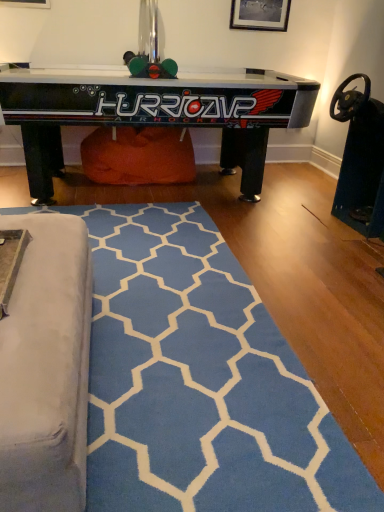
Question: Is black glossy air hockey table at upper center positioned with its back to wooden picture frame at upper center?

Choices:
 (A) yes
 (B) no

Answer: (A)

Question: Is black glossy air hockey table at upper center shorter than wooden picture frame at upper center?

Choices:
 (A) no
 (B) yes

Answer: (A)

Question: Does black glossy air hockey table at upper center have a lesser width compared to wooden picture frame at upper center?

Choices:
 (A) no
 (B) yes

Answer: (A)

Question: Can you confirm if black glossy air hockey table at upper center is smaller than wooden picture frame at upper center?

Choices:
 (A) no
 (B) yes

Answer: (A)

Question: Is black glossy air hockey table at upper center at the left side of wooden picture frame at upper center?

Choices:
 (A) yes
 (B) no

Answer: (A)

Question: In terms of size, does black glossy air hockey table at upper center appear bigger or smaller than blue soft rug at lower center?

Choices:
 (A) big
 (B) small

Answer: (A)

Question: Is black glossy air hockey table at upper center in front of or behind blue soft rug at lower center in the image?

Choices:
 (A) behind
 (B) front

Answer: (A)

Question: From their relative heights in the image, would you say black glossy air hockey table at upper center is taller or shorter than blue soft rug at lower center?

Choices:
 (A) short
 (B) tall

Answer: (B)

Question: Considering the positions of black glossy air hockey table at upper center and blue soft rug at lower center in the image, is black glossy air hockey table at upper center wider or thinner than blue soft rug at lower center?

Choices:
 (A) wide
 (B) thin

Answer: (B)

Question: Does point (72, 71) appear closer or farther from the camera than point (256, 24)?

Choices:
 (A) closer
 (B) farther

Answer: (A)

Question: Relative to wooden picture frame at upper center, is black glossy air hockey table at upper center in front or behind?

Choices:
 (A) front
 (B) behind

Answer: (A)

Question: From a real-world perspective, is black glossy air hockey table at upper center physically located above or below wooden picture frame at upper center?

Choices:
 (A) above
 (B) below

Answer: (B)

Question: From the image's perspective, relative to wooden picture frame at upper center, is black glossy air hockey table at upper center above or below?

Choices:
 (A) above
 (B) below

Answer: (B)

Question: From the image's perspective, is wooden picture frame at upper center positioned above or below blue soft rug at lower center?

Choices:
 (A) below
 (B) above

Answer: (B)

Question: Considering the positions of point (266, 3) and point (304, 445), is point (266, 3) closer or farther from the camera than point (304, 445)?

Choices:
 (A) closer
 (B) farther

Answer: (B)